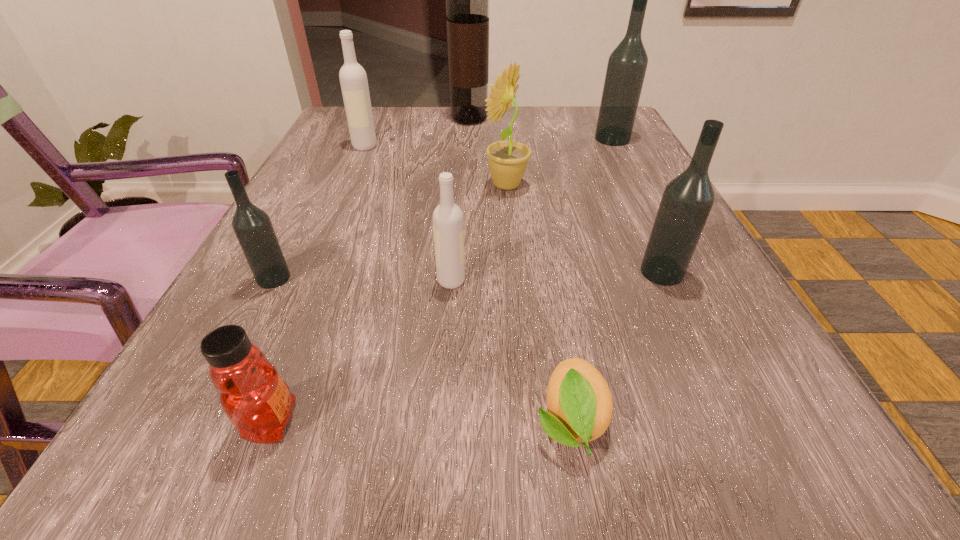
This screenshot has height=540, width=960. I want to click on free spot located 0.280m on the face of the sunflower, so click(345, 185).

At what (x,y) coordinates should I click in order to perform the action: click on vacant space located on the face of the sunflower. Please return your answer as a coordinate pair (x, y). The height and width of the screenshot is (540, 960). Looking at the image, I should click on (409, 185).

Identify the location of free region located on the face of the sunflower. [389, 185].

Find the location of a particular element. Image resolution: width=960 pixels, height=540 pixels. free location located on the right of the right white vodka is located at coordinates (504, 280).

Locate an element on the screen. free region located 0.060m on the back of the leftmost black vodka is located at coordinates (291, 245).

I want to click on vacant space situated 0.140m on the front label of the honey, so click(423, 421).

Locate an element on the screen. The height and width of the screenshot is (540, 960). wine bottle located at the far edge is located at coordinates (467, 0).

This screenshot has height=540, width=960. I want to click on honey present at the near edge, so click(x=254, y=397).

Find the location of `lemon situated at the near edge`. lemon situated at the near edge is located at coordinates (579, 401).

This screenshot has height=540, width=960. I want to click on honey at the left edge, so click(x=254, y=397).